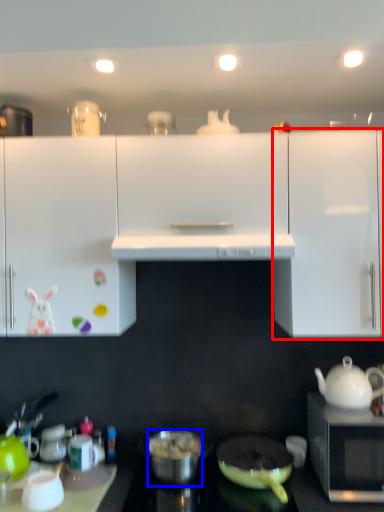
Question: Which of the following is the farthest to the observer, cabinetry (highlighted by a red box) or pot/pan (highlighted by a blue box)?

Choices:
 (A) cabinetry
 (B) pot/pan

Answer: (B)